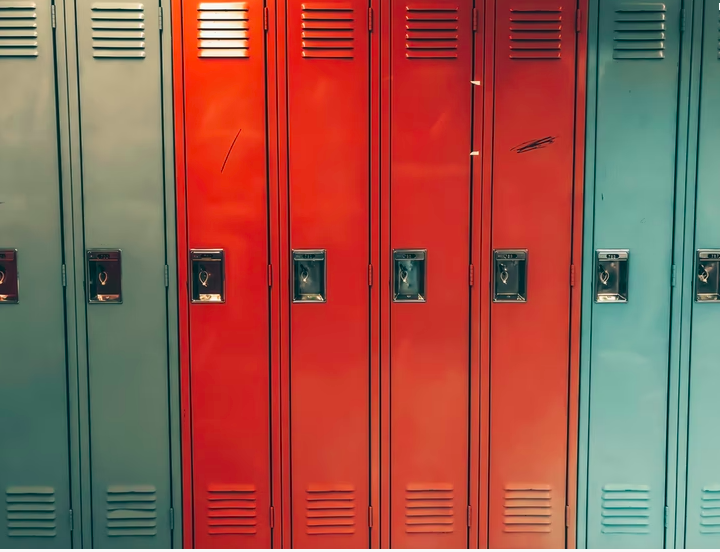
Locate an element on the screen. The height and width of the screenshot is (552, 720). upper vents of locker is located at coordinates (616, 39), (543, 41), (441, 38), (229, 26), (14, 36).